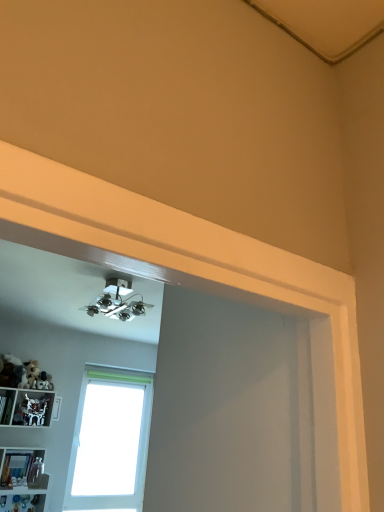
Question: Can you confirm if translucent plastic bottles at lower left, the 2th shelf when ordered from top to bottom, is shorter than white plastic shelf at lower left, which is the second shelf from bottom to top?

Choices:
 (A) no
 (B) yes

Answer: (B)

Question: Is translucent plastic bottles at lower left, acting as the first shelf starting from the bottom, further to camera compared to white plastic shelf at lower left, arranged as the first shelf when viewed from the top?

Choices:
 (A) yes
 (B) no

Answer: (B)

Question: From the image's perspective, is translucent plastic bottles at lower left, acting as the first shelf starting from the bottom, above white plastic shelf at lower left, arranged as the first shelf when viewed from the top?

Choices:
 (A) no
 (B) yes

Answer: (A)

Question: Can you confirm if translucent plastic bottles at lower left, acting as the first shelf starting from the bottom, is smaller than white plastic shelf at lower left, arranged as the first shelf when viewed from the top?

Choices:
 (A) no
 (B) yes

Answer: (B)

Question: Is translucent plastic bottles at lower left, the 2th shelf when ordered from top to bottom, oriented away from white plastic shelf at lower left, arranged as the first shelf when viewed from the top?

Choices:
 (A) no
 (B) yes

Answer: (A)

Question: In terms of size, does white plastic shelf at lower left, arranged as the first shelf when viewed from the top, appear bigger or smaller than translucent plastic bottles at lower left, acting as the first shelf starting from the bottom?

Choices:
 (A) big
 (B) small

Answer: (A)

Question: Based on their positions, is white plastic shelf at lower left, which is the second shelf from bottom to top, located to the left or right of translucent plastic bottles at lower left, acting as the first shelf starting from the bottom?

Choices:
 (A) right
 (B) left

Answer: (B)

Question: From the image's perspective, is white plastic shelf at lower left, arranged as the first shelf when viewed from the top, located above or below translucent plastic bottles at lower left, the 2th shelf when ordered from top to bottom?

Choices:
 (A) below
 (B) above

Answer: (B)

Question: From their relative heights in the image, would you say white plastic shelf at lower left, which is the second shelf from bottom to top, is taller or shorter than translucent plastic bottles at lower left, the 2th shelf when ordered from top to bottom?

Choices:
 (A) tall
 (B) short

Answer: (A)

Question: From the image's perspective, relative to white frosted glass window at center, is white plastic shelf at lower left, which is the second shelf from bottom to top, above or below?

Choices:
 (A) above
 (B) below

Answer: (A)

Question: Is point (11, 411) closer or farther from the camera than point (147, 415)?

Choices:
 (A) closer
 (B) farther

Answer: (A)

Question: From a real-world perspective, is white plastic shelf at lower left, arranged as the first shelf when viewed from the top, positioned above or below white frosted glass window at center?

Choices:
 (A) below
 (B) above

Answer: (B)

Question: Is white plastic shelf at lower left, which is the second shelf from bottom to top, inside or outside of white frosted glass window at center?

Choices:
 (A) inside
 (B) outside

Answer: (B)

Question: Is point (11, 449) closer or farther from the camera than point (11, 399)?

Choices:
 (A) closer
 (B) farther

Answer: (A)

Question: Is translucent plastic bottles at lower left, the 2th shelf when ordered from top to bottom, inside or outside of white plastic shelf at lower left, arranged as the first shelf when viewed from the top?

Choices:
 (A) outside
 (B) inside

Answer: (A)